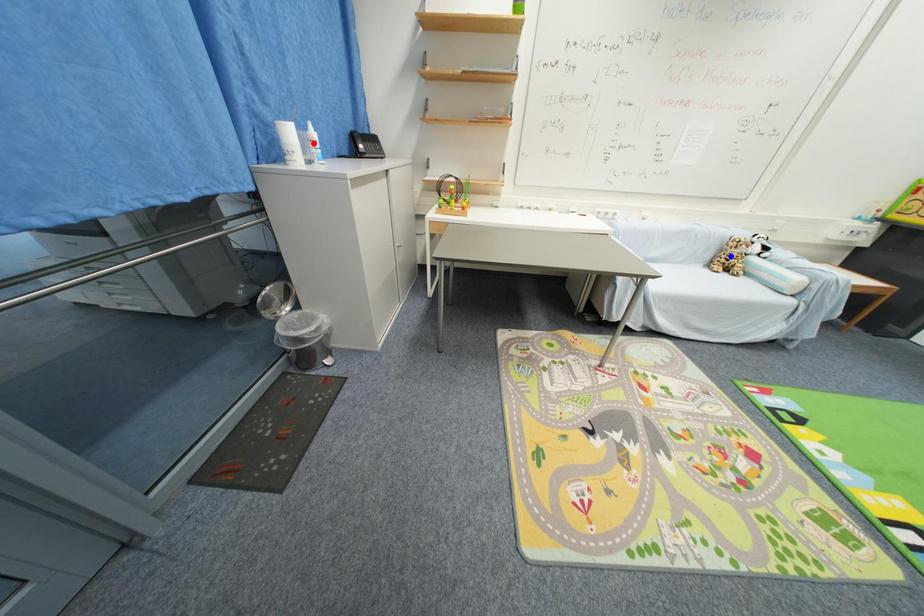
Question: Two points are marked on the image. Which point is closer to the camera?

Choices:
 (A) Blue point is closer.
 (B) Red point is closer.

Answer: (B)